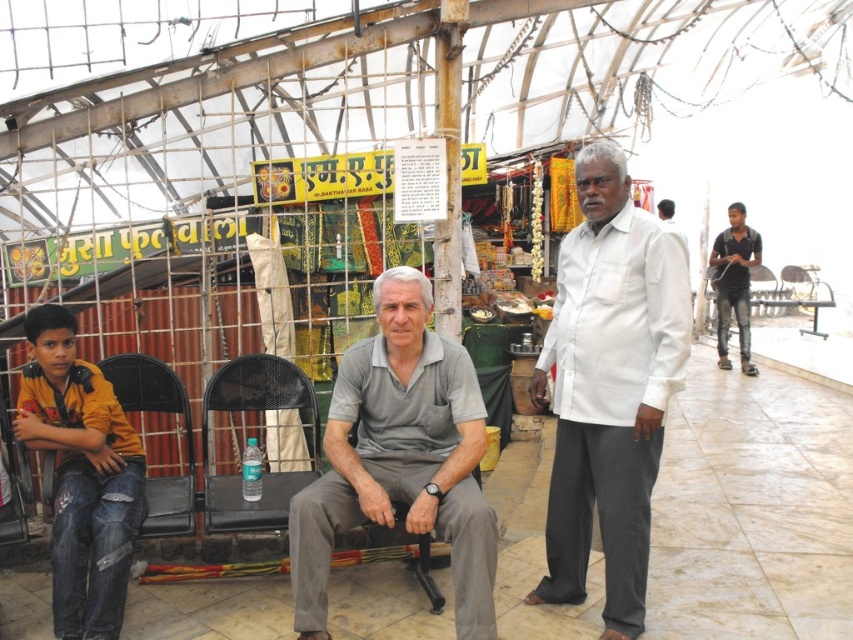
You are standing at the entrance of the market and see the white cotton shirt at center and the jeans at left. Which clothing item is closer to you?

The white cotton shirt at center is closer to you because the jeans at left is behind it.

Based on the photo, please look at the image and identify which object corresponds to the coordinates point (399, 458). The options are the young boy in yellow and orange shirt at left, the older man in gray short sleeved polo shirt at center, and the black chair at lower right.

The point (399, 458) corresponds to the gray cotton shirt at center.